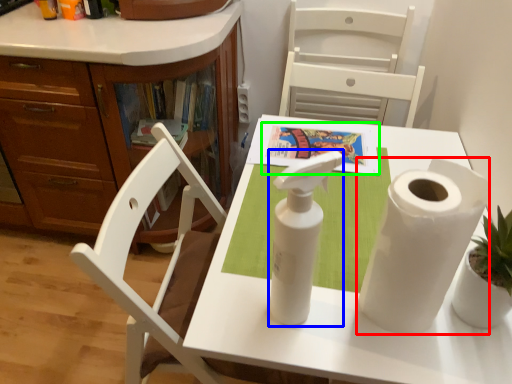
Question: Considering the real-world distances, which object is closest to paper towel (highlighted by a red box)? soap dispenser (highlighted by a blue box) or book (highlighted by a green box).

Choices:
 (A) soap dispenser
 (B) book

Answer: (A)